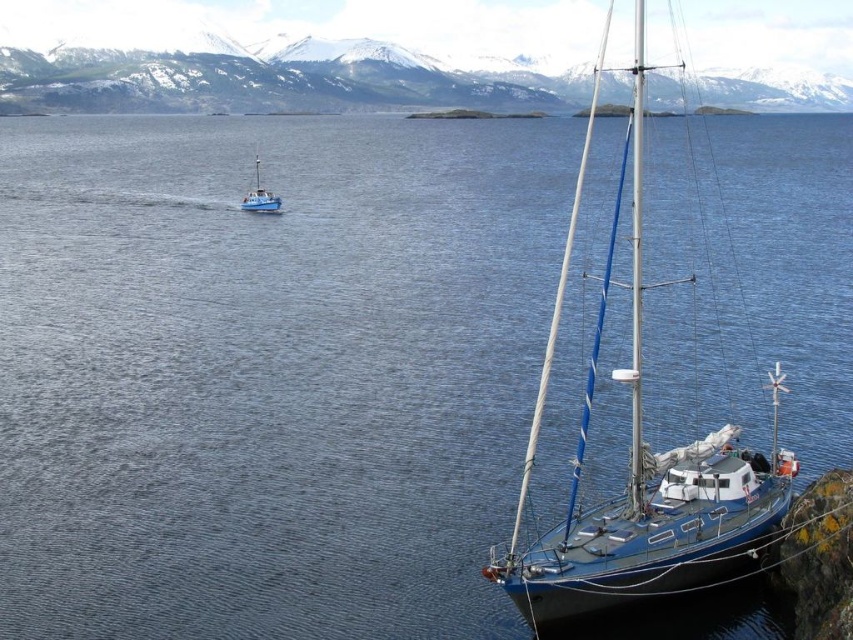
Between metallic blue sailboat at right and snowy mountain at upper center, which one is positioned lower?

Positioned lower is metallic blue sailboat at right.

Does metallic blue sailboat at right have a greater height compared to snowy mountain at upper center?

Indeed, metallic blue sailboat at right has a greater height compared to snowy mountain at upper center.

You are a GUI agent. You are given a task and a screenshot of the screen. Output one action in this format:
    pyautogui.click(x=<x>, y=<y>)
    Task: Click on the metallic blue sailboat at right
    This screenshot has height=640, width=853.
    Given the screenshot: What is the action you would take?
    pyautogui.click(x=641, y=465)

Is snowy mountain at upper center smaller than blue matte boat at upper left?

No, snowy mountain at upper center is not smaller than blue matte boat at upper left.

Who is more forward, (236, 72) or (245, 195)?

Point (245, 195)

Where is `snowy mountain at upper center`? This screenshot has height=640, width=853. snowy mountain at upper center is located at coordinates (270, 77).

Is metallic blue sailboat at right behind blue matte boat at upper left?

No, metallic blue sailboat at right is in front of blue matte boat at upper left.

Can you confirm if metallic blue sailboat at right is bigger than blue matte boat at upper left?

Yes.

At what (x,y) coordinates should I click in order to perform the action: click on metallic blue sailboat at right. Please return your answer as a coordinate pair (x, y). Looking at the image, I should click on (641, 465).